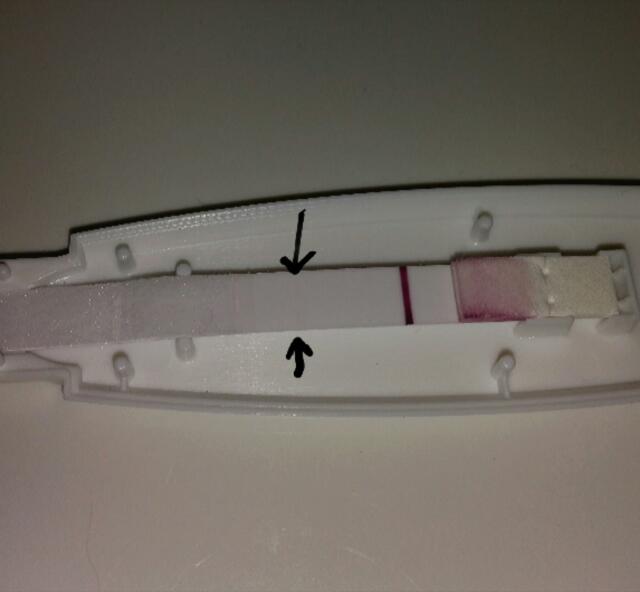
Where is `emptyspace on tabletop`? The image size is (640, 592). emptyspace on tabletop is located at coordinates (228, 474).